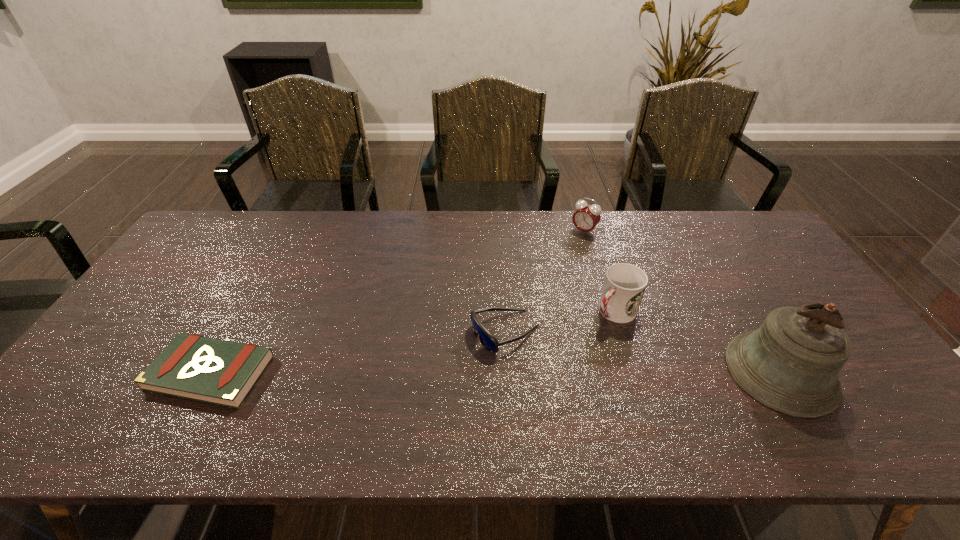
At what (x,y) coordinates should I click in order to perform the action: click on vacant space located on the handle side of the cup. Please return your answer as a coordinate pair (x, y). Image resolution: width=960 pixels, height=540 pixels. Looking at the image, I should click on (511, 404).

You are a GUI agent. You are given a task and a screenshot of the screen. Output one action in this format:
    pyautogui.click(x=<x>, y=<y>)
    Task: Click on the free space located 0.290m on the handle side of the cup
    Image resolution: width=960 pixels, height=540 pixels.
    Given the screenshot: What is the action you would take?
    pyautogui.click(x=531, y=386)

Where is `vacant space located on the handle side of the cup`? The image size is (960, 540). vacant space located on the handle side of the cup is located at coordinates (539, 379).

Where is `free space located 0.240m on the clock face of the farthest object`? The height and width of the screenshot is (540, 960). free space located 0.240m on the clock face of the farthest object is located at coordinates [x=545, y=276].

Identify the location of free spot located 0.090m on the clock face of the farthest object. (566, 251).

The image size is (960, 540). I want to click on vacant area located on the clock face of the farthest object, so click(x=563, y=255).

Where is `free space located on the front-facing side of the sunglasses`? Image resolution: width=960 pixels, height=540 pixels. free space located on the front-facing side of the sunglasses is located at coordinates tap(454, 354).

Identify the location of free space located 0.160m on the front-facing side of the sunglasses. (419, 370).

Where is `vacant space positioned 0.070m on the front-facing side of the sunglasses`? The height and width of the screenshot is (540, 960). vacant space positioned 0.070m on the front-facing side of the sunglasses is located at coordinates (451, 356).

This screenshot has width=960, height=540. I want to click on object that is positioned at the far edge, so click(x=587, y=216).